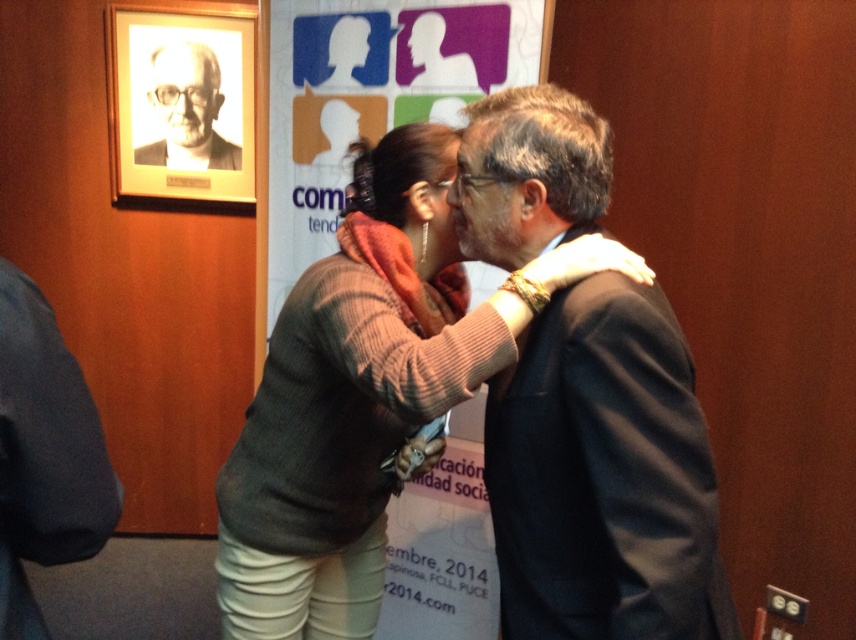
You are a photographer setting up for a group photo. You need to position the white paper portrait at upper left and the matte black suit at center so that they are exactly 2 meters apart. Based on the current scene, will you need to move them closer or farther apart to achieve this?

The white paper portrait at upper left and matte black suit at center are already 2.02 meters apart, which is slightly more than 2 meters. Therefore, you should move them closer by 2 centimeters to reach the desired distance.

You are standing in the room and want to move from the point at coordinates point [74,451] to the point at coordinates point [209,161]. Which direction should you move?

You should move towards the left and downward since point [74,451] is in front of point [209,161], indicating that it is closer to you. To reach the second point, you need to move away from your current position towards the left and downward direction.